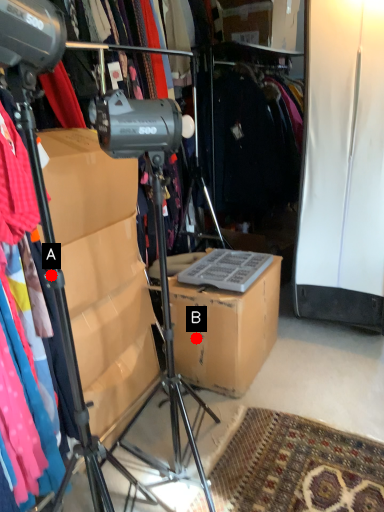
Question: Two points are circled on the image, labeled by A and B beside each circle. Which point is closer to the camera taking this photo?

Choices:
 (A) A is closer
 (B) B is closer

Answer: (A)